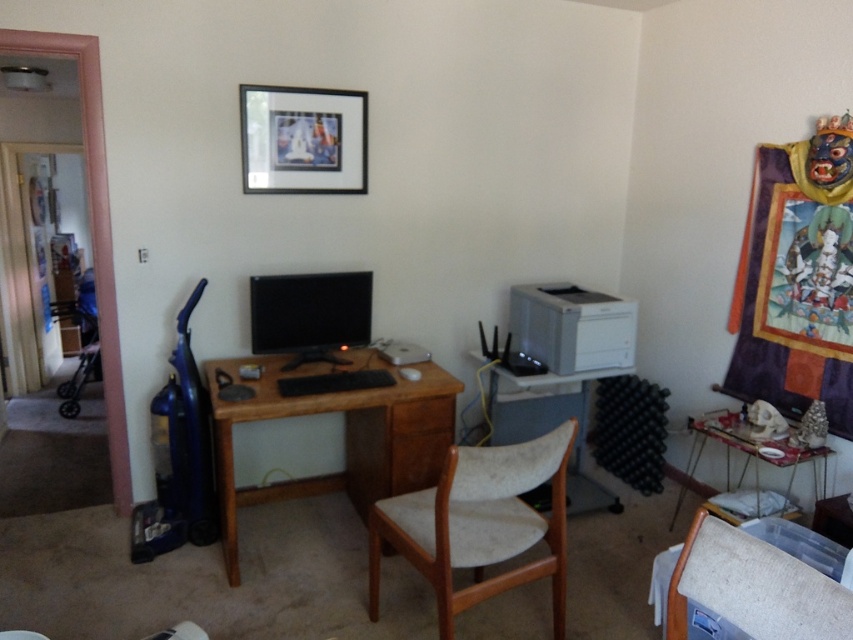
Does metallic silver table at lower right come in front of beige fabric swivel chair at lower right?

No, it is behind beige fabric swivel chair at lower right.

Is point (762, 445) less distant than point (666, 611)?

That is False.

Identify the location of metallic silver table at lower right. The height and width of the screenshot is (640, 853). (747, 456).

Is black matte picture frame at upper center to the left of metallic silver table at lower right from the viewer's perspective?

Correct, you'll find black matte picture frame at upper center to the left of metallic silver table at lower right.

At what (x,y) coordinates should I click in order to perform the action: click on black matte picture frame at upper center. Please return your answer as a coordinate pair (x, y). The image size is (853, 640). Looking at the image, I should click on (302, 140).

This screenshot has height=640, width=853. What do you see at coordinates (550, 422) in the screenshot? I see `wooden desk at center` at bounding box center [550, 422].

Which is in front, point (601, 508) or point (798, 456)?

Point (798, 456) is in front.

Describe the element at coordinates (550, 422) in the screenshot. I see `wooden desk at center` at that location.

The width and height of the screenshot is (853, 640). Identify the location of wooden desk at center. (550, 422).